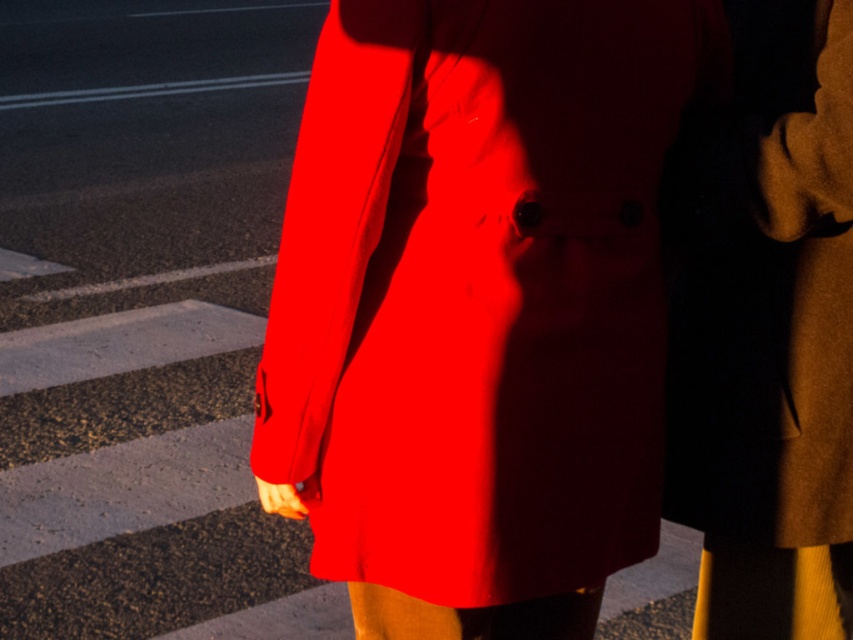
The width and height of the screenshot is (853, 640). Describe the element at coordinates (479, 291) in the screenshot. I see `matte red coat at center` at that location.

Is matte red coat at center to the left of brown woolen trench coat at right from the viewer's perspective?

Correct, you'll find matte red coat at center to the left of brown woolen trench coat at right.

Locate an element on the screen. This screenshot has height=640, width=853. matte red coat at center is located at coordinates (479, 291).